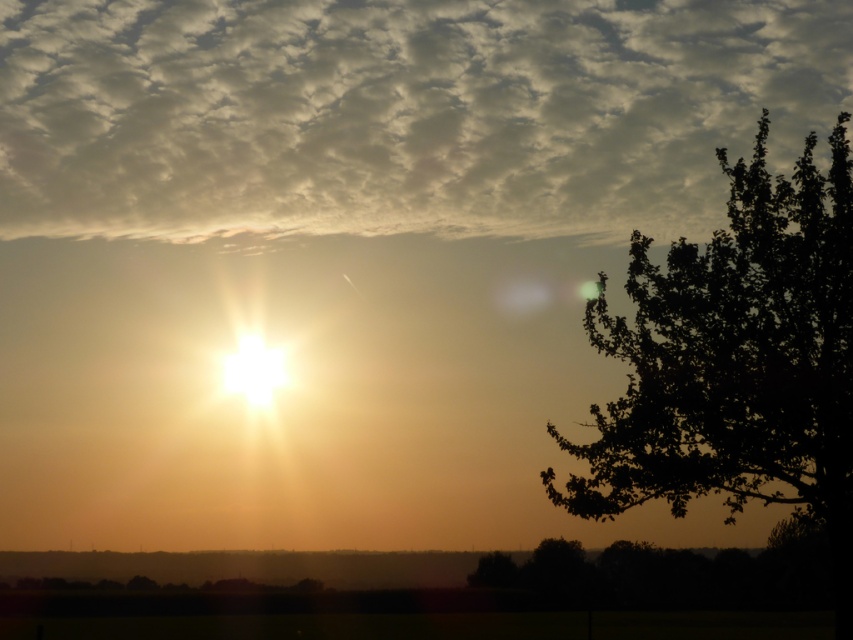
Question: Does cloudy sky at upper center appear on the left side of dark green leafy tree at right?

Choices:
 (A) no
 (B) yes

Answer: (B)

Question: Does cloudy sky at upper center lie in front of dark green leafy tree at right?

Choices:
 (A) no
 (B) yes

Answer: (A)

Question: Does cloudy sky at upper center have a greater width compared to dark green leafy tree at right?

Choices:
 (A) yes
 (B) no

Answer: (A)

Question: Among these objects, which one is nearest to the camera?

Choices:
 (A) cloudy sky at upper center
 (B) dark green leafy tree at right

Answer: (B)